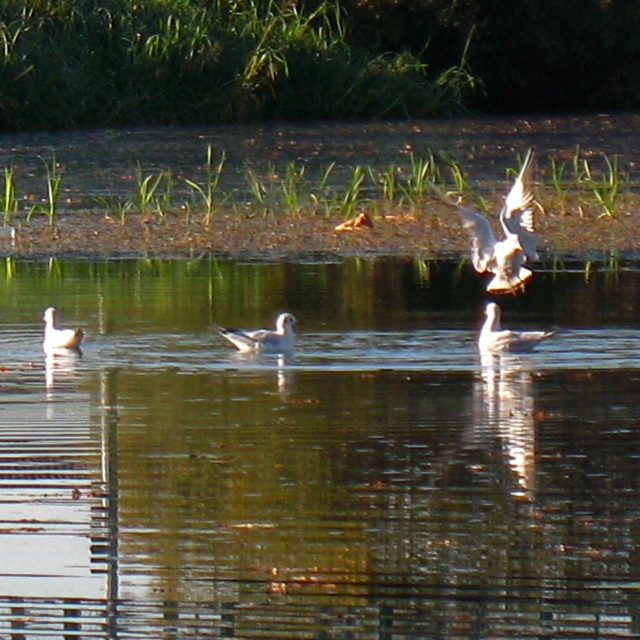
How distant is white matte duck at center from white matte seagull at center?

They are 1.64 meters apart.

Can you confirm if white matte duck at center is wider than white matte seagull at center?

Indeed, white matte duck at center has a greater width compared to white matte seagull at center.

Identify the location of white matte duck at center. (506, 336).

Between point (44, 385) and point (524, 240), which one is positioned in front?

Positioned in front is point (524, 240).

Is clear water at center smaller than white feathered bird at upper right?

No, clear water at center is not smaller than white feathered bird at upper right.

Does point (563, 388) lie in front of point (529, 161)?

That is False.

The image size is (640, 640). What are the coordinates of `clear water at center` in the screenshot? It's located at (316, 454).

Is point (524, 337) farther from viewer compared to point (44, 339)?

No, it is not.

Does white matte duck at center appear under white matte duck at left?

Actually, white matte duck at center is above white matte duck at left.

I want to click on white matte duck at center, so click(506, 336).